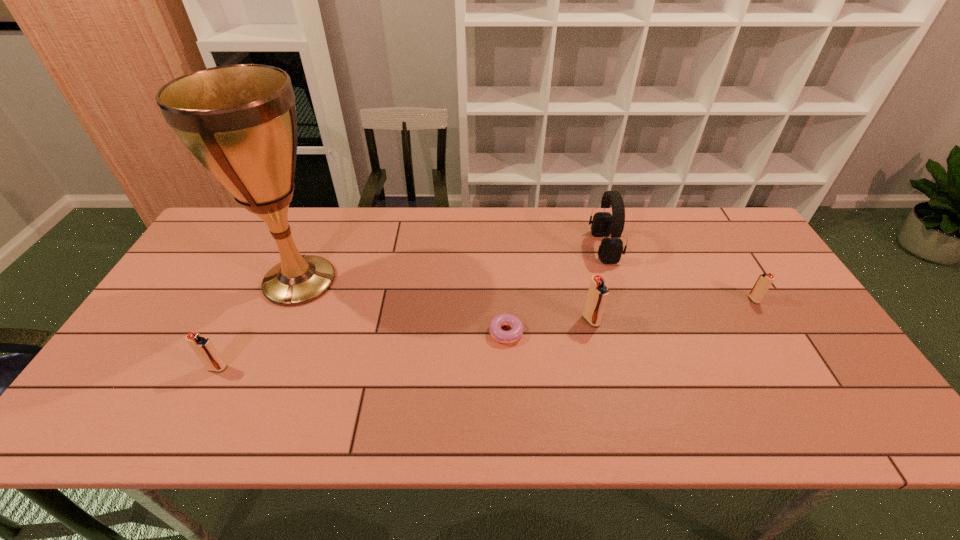
You are a GUI agent. You are given a task and a screenshot of the screen. Output one action in this format:
    pyautogui.click(x=<x>, y=<y>)
    Task: Click on the empty space that is in between the fourth object from right to left and the second tallest object
    This screenshot has width=960, height=540.
    Given the screenshot: What is the action you would take?
    pyautogui.click(x=555, y=288)

I want to click on empty space that is in between the second shortest igniter and the doughnut, so click(362, 349).

I want to click on free spot between the farthest igniter and the fourth object from left to right, so click(672, 310).

Image resolution: width=960 pixels, height=540 pixels. I want to click on vacant space that's between the headset and the second shortest object, so click(x=679, y=273).

Where is `vacant point located between the second tallest igniter and the fourth object from left to right`? The width and height of the screenshot is (960, 540). vacant point located between the second tallest igniter and the fourth object from left to right is located at coordinates (404, 344).

The height and width of the screenshot is (540, 960). I want to click on free space between the second tallest object and the fourth object from right to left, so click(555, 288).

The width and height of the screenshot is (960, 540). What are the coordinates of `empty space between the second shortest object and the tallest object` in the screenshot? It's located at (527, 290).

You are a GUI agent. You are given a task and a screenshot of the screen. Output one action in this format:
    pyautogui.click(x=<x>, y=<y>)
    Task: Click on the unoccupied position between the headset and the shortest object
    Image resolution: width=960 pixels, height=540 pixels.
    Given the screenshot: What is the action you would take?
    pyautogui.click(x=555, y=288)

Identify the location of object identified as the fifth closest to the third tallest object. (202, 346).

Locate which object is the fifth closest to the fifth shortest object. Please provide its 2D coordinates. Your answer should be formatted as a tuple, i.e. [(x, y)], where the tuple contains the x and y coordinates of a point satisfying the conditions above.

[(202, 346)]